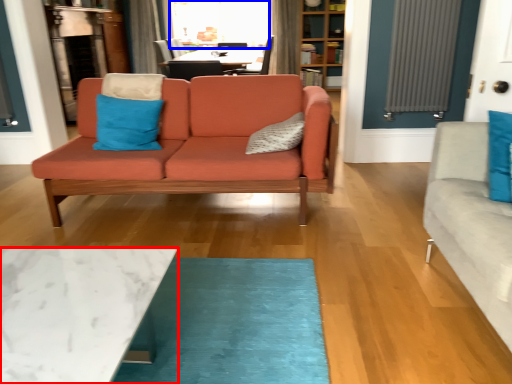
Question: Which point is closer to the camera, coffee table (highlighted by a red box) or window screen (highlighted by a blue box)?

Choices:
 (A) coffee table
 (B) window screen

Answer: (A)